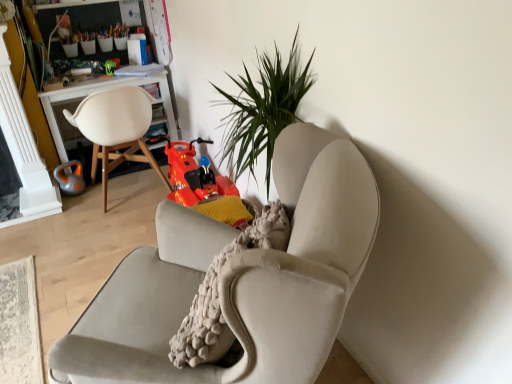
This screenshot has width=512, height=384. In order to click on free location in front of white matte chair at left, which is counted as the 1th chair, starting from the left in this screenshot , I will do `click(100, 236)`.